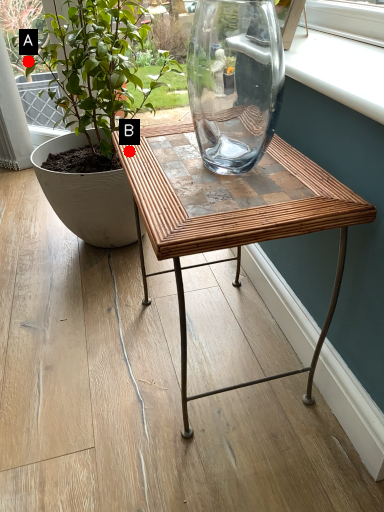
Question: Two points are circled on the image, labeled by A and B beside each circle. Which of the following is the closest to the observer?

Choices:
 (A) A is closer
 (B) B is closer

Answer: (B)